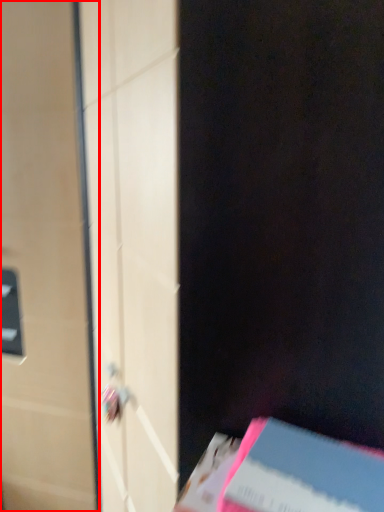
Question: In this image, where is door (annotated by the red box) located relative to paperback book?

Choices:
 (A) left
 (B) right

Answer: (A)